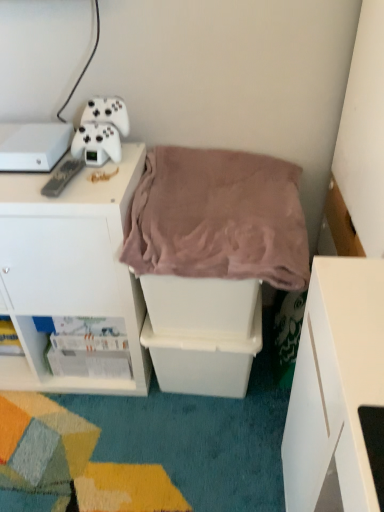
Locate an element on the screen. The image size is (384, 512). free space in front of white plastic cabinet at upper left is located at coordinates (75, 444).